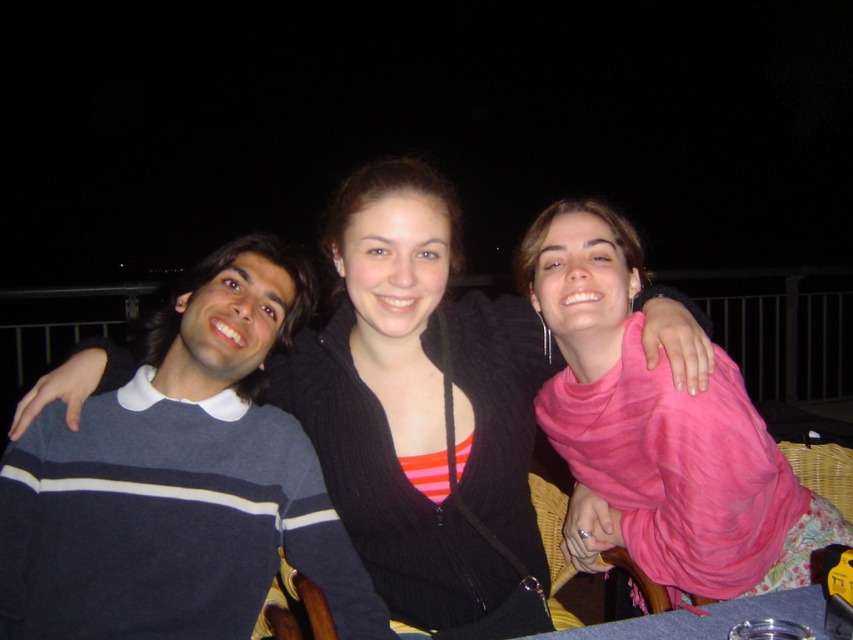
Consider the image. Between black knit sweater at center and pink fabric scarf at upper right, which one appears on the left side from the viewer's perspective?

From the viewer's perspective, black knit sweater at center appears more on the left side.

Is point (334, 456) farther from camera compared to point (677, 440)?

Yes, it is.

Where is `black knit sweater at center`? black knit sweater at center is located at coordinates (390, 392).

Is dark blue striped sweater at left to the right of pink fabric scarf at upper right from the viewer's perspective?

In fact, dark blue striped sweater at left is to the left of pink fabric scarf at upper right.

Is dark blue striped sweater at left positioned at the back of pink fabric scarf at upper right?

No, dark blue striped sweater at left is in front of pink fabric scarf at upper right.

Describe the element at coordinates (178, 481) in the screenshot. The width and height of the screenshot is (853, 640). I see `dark blue striped sweater at left` at that location.

At what (x,y) coordinates should I click in order to perform the action: click on dark blue striped sweater at left. Please return your answer as a coordinate pair (x, y). The height and width of the screenshot is (640, 853). Looking at the image, I should click on (178, 481).

Which is more to the left, dark blue striped sweater at left or black knit sweater at center?

From the viewer's perspective, dark blue striped sweater at left appears more on the left side.

Find the location of a particular element. The width and height of the screenshot is (853, 640). dark blue striped sweater at left is located at coordinates (178, 481).

Describe the element at coordinates (178, 481) in the screenshot. I see `dark blue striped sweater at left` at that location.

Find the location of `dark blue striped sweater at left`. dark blue striped sweater at left is located at coordinates (178, 481).